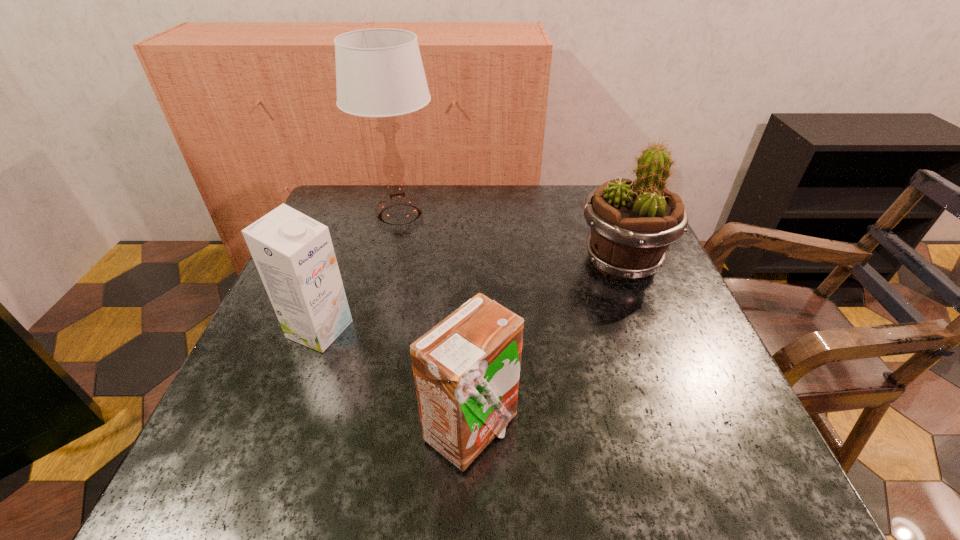
Where is `free space between the second nearest object and the rightmost object`? The width and height of the screenshot is (960, 540). free space between the second nearest object and the rightmost object is located at coordinates (470, 295).

Identify the location of free point between the left carton and the nearer carton. (396, 380).

Image resolution: width=960 pixels, height=540 pixels. Identify the location of object that stands as the closest to the flowerpot. pos(466,369).

Locate an element on the screen. This screenshot has height=540, width=960. the third closest object relative to the table lamp is located at coordinates (466, 369).

Where is `blank space that satisfies the following two spatial constraints: 1. on the front side of the rightmost object; 2. on the straw side of the right carton`? The height and width of the screenshot is (540, 960). blank space that satisfies the following two spatial constraints: 1. on the front side of the rightmost object; 2. on the straw side of the right carton is located at coordinates (686, 430).

Find the location of `free location that satisfies the following two spatial constraints: 1. on the back side of the flowerpot; 2. on the right side of the left carton`. free location that satisfies the following two spatial constraints: 1. on the back side of the flowerpot; 2. on the right side of the left carton is located at coordinates (345, 262).

I want to click on free space that satisfies the following two spatial constraints: 1. on the back side of the third farthest object; 2. on the right side of the rightmost object, so click(345, 262).

Where is `blank area in the image that satisfies the following two spatial constraints: 1. on the front side of the rightmost object; 2. on the straw side of the second object from right to left`? The image size is (960, 540). blank area in the image that satisfies the following two spatial constraints: 1. on the front side of the rightmost object; 2. on the straw side of the second object from right to left is located at coordinates (686, 430).